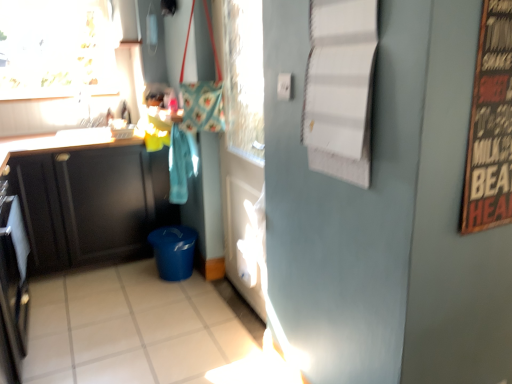
Find the location of a particular element. This screenshot has height=384, width=512. blank space situated above white glossy tile at lower center (from a real-world perspective) is located at coordinates (119, 319).